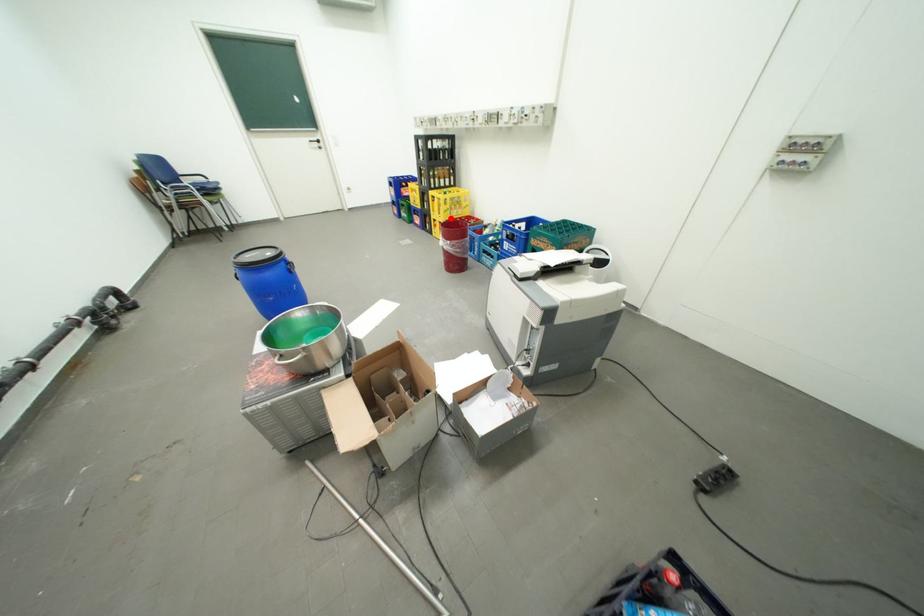
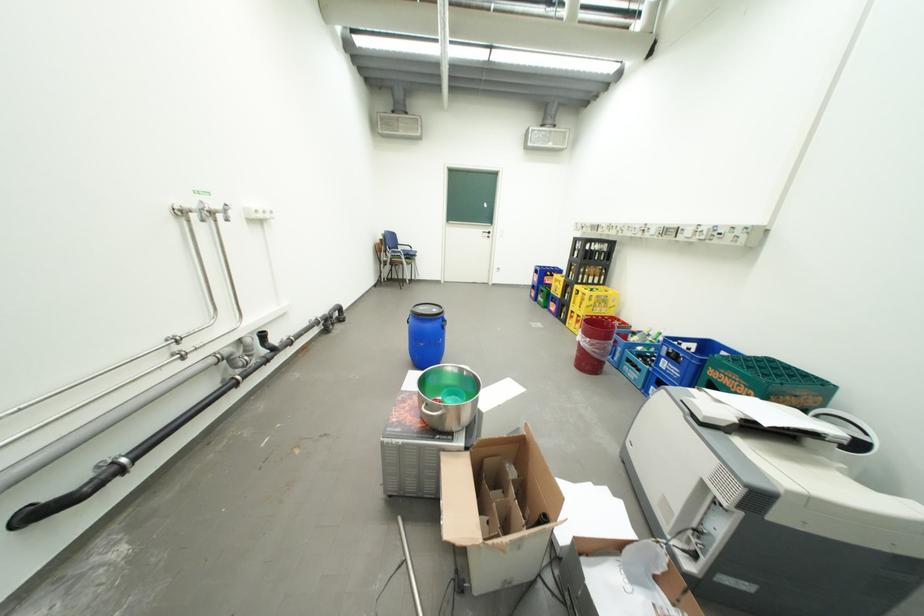
Question: I am providing you with two images of the same scene from different viewpoints. Image1 has a red point marked. In image2, the corresponding 3D location appears at what relative position? Reply with the corresponding letter.

Choices:
 (A) Closer
 (B) Farther

Answer: (A)